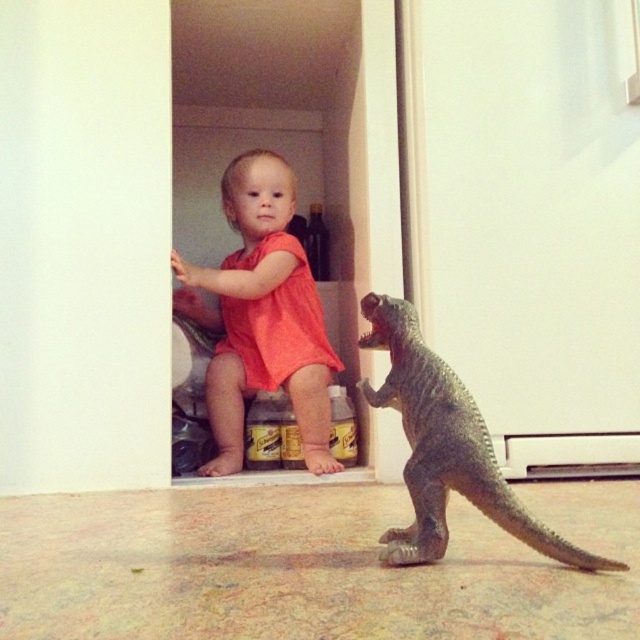
You are a parent trying to dress your child. You have a matte orange romper at center and a gray matte plastic dinosaur at lower right. Which item is bigger?

The matte orange romper at center is larger in size compared to the gray matte plastic dinosaur at lower right.